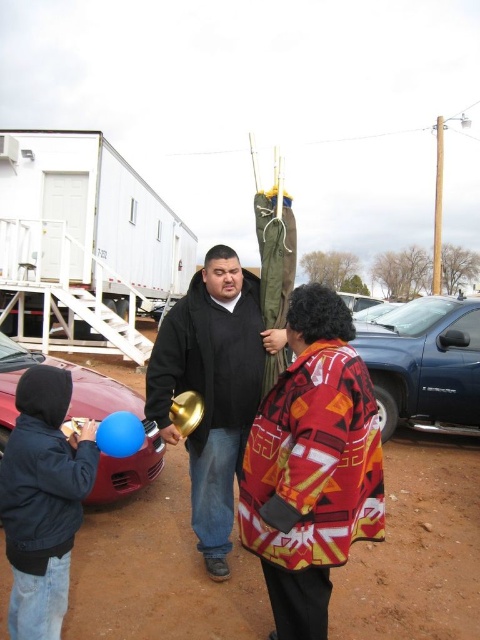
Does navy blue jacket at lower left have a lesser width compared to blue metallic truck at lower right?

Correct, navy blue jacket at lower left's width is less than blue metallic truck at lower right's.

Between navy blue jacket at lower left and blue metallic truck at lower right, which one is positioned higher?

blue metallic truck at lower right is higher up.

Does point (58, 440) come behind point (365, 323)?

No, (58, 440) is closer to viewer.

Where is `navy blue jacket at lower left`? This screenshot has width=480, height=640. navy blue jacket at lower left is located at coordinates tap(43, 500).

Does brown dirt field at center have a lesser width compared to blue metallic truck at lower right?

Yes, brown dirt field at center is thinner than blue metallic truck at lower right.

Can you confirm if brown dirt field at center is taller than blue metallic truck at lower right?

No.

Where is `brown dirt field at center`? The height and width of the screenshot is (640, 480). brown dirt field at center is located at coordinates (418, 547).

Does blue metallic truck at lower right have a smaller size compared to shiny red car at lower left?

Actually, blue metallic truck at lower right might be larger than shiny red car at lower left.

I want to click on blue metallic truck at lower right, so click(423, 362).